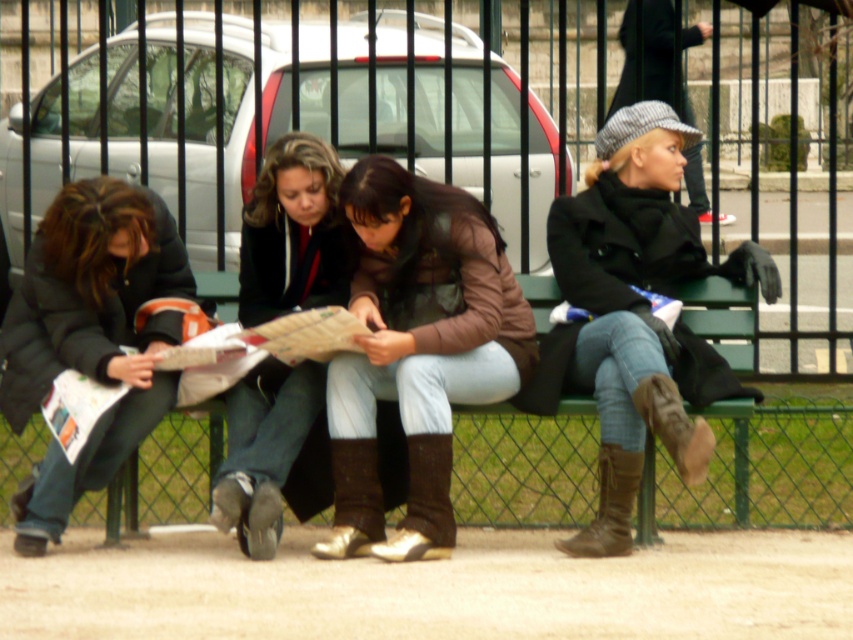
Question: Estimate the real-world distances between objects in this image. Which object is farther from the brown leather boot at lower right?

Choices:
 (A) silver metallic car at center
 (B) brown suede boot at lower center
 (C) matte black jacket at center

Answer: (A)

Question: Is brown leather boots at center positioned at the back of brown leather boot at lower right?

Choices:
 (A) yes
 (B) no

Answer: (B)

Question: Is silver metallic car at center behind dark gray wool coat at left?

Choices:
 (A) no
 (B) yes

Answer: (B)

Question: Considering the real-world distances, which object is closest to the leather brown jacket at center?

Choices:
 (A) brown suede boot at lower right
 (B) dark gray wool coat at left
 (C) silver metallic car at center
 (D) brown suede boot at center

Answer: (D)

Question: Which object is closer to the camera taking this photo?

Choices:
 (A) leather brown jacket at center
 (B) brown leather boot at lower right
 (C) brown leather boots at center

Answer: (C)

Question: Is matte black jacket at center to the right of brown suede boot at lower center from the viewer's perspective?

Choices:
 (A) no
 (B) yes

Answer: (A)